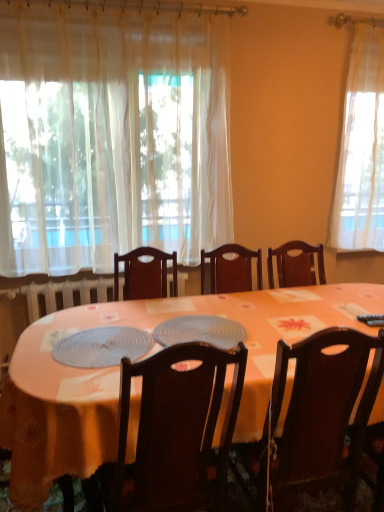
Identify the location of empty space that is to the right of translucent plastic placemat at center, marked as the 2th platter in a left-to-right arrangement. (265, 328).